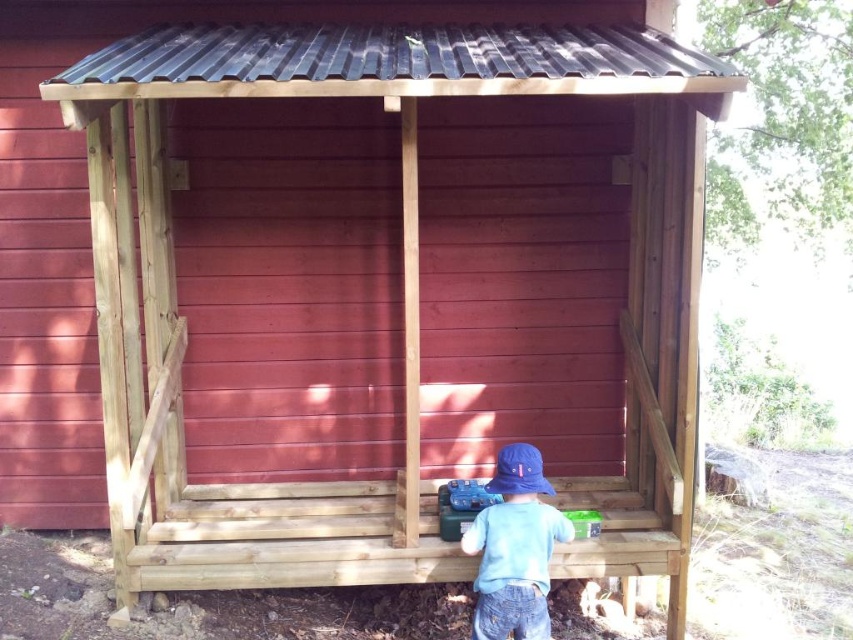
From the picture: Which is more to the right, light blue cotton shirt at center or blue fabric baseball hat at lower center?

Positioned to the right is blue fabric baseball hat at lower center.

Between light blue cotton shirt at center and blue fabric baseball hat at lower center, which one is positioned lower?

light blue cotton shirt at center is below.

Identify the location of light blue cotton shirt at center. (514, 548).